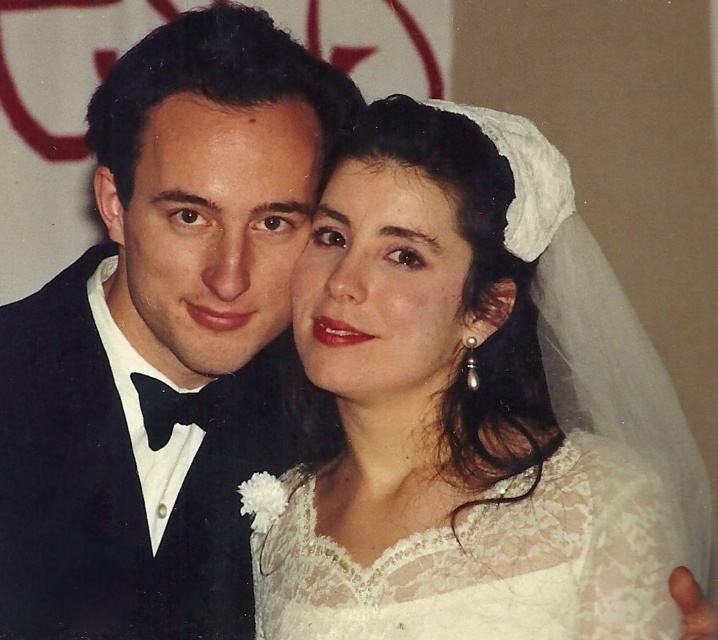
Is black satin tuxedo at left to the left of white lace dress at center from the viewer's perspective?

Correct, you'll find black satin tuxedo at left to the left of white lace dress at center.

Is black satin tuxedo at left positioned before white lace dress at center?

No, it is behind white lace dress at center.

This screenshot has height=640, width=718. Describe the element at coordinates (163, 339) in the screenshot. I see `black satin tuxedo at left` at that location.

You are a GUI agent. You are given a task and a screenshot of the screen. Output one action in this format:
    pyautogui.click(x=<x>, y=<y>)
    Task: Click on the black satin tuxedo at left
    
    Given the screenshot: What is the action you would take?
    pyautogui.click(x=163, y=339)

Who is more forward, (x=391, y=120) or (x=500, y=540)?

Positioned in front is point (x=500, y=540).

Does white lace veil at upper center have a lesser height compared to white lace dress at center?

In fact, white lace veil at upper center may be taller than white lace dress at center.

Who is more forward, (651,576) or (320,561)?

Point (651,576) is more forward.

The height and width of the screenshot is (640, 718). Find the location of `white lace veil at upper center`. white lace veil at upper center is located at coordinates (472, 408).

Which is behind, point (269, 531) or point (90, 490)?

Positioned behind is point (269, 531).

Does white lace veil at upper center appear over black satin tuxedo at left?

No.

Which is in front, point (264, 536) or point (215, 296)?

Point (215, 296)

Locate an element on the screen. white lace veil at upper center is located at coordinates (472, 408).